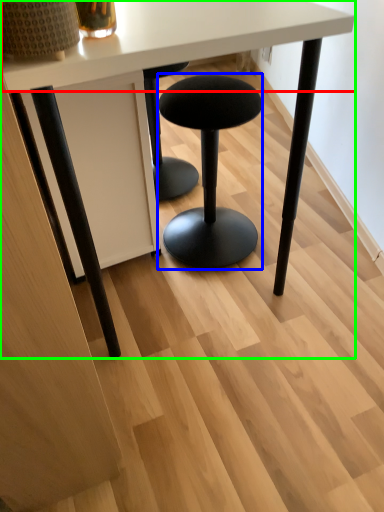
Question: Which object is the closest to the round table (highlighted by a red box)? Choose among these: stool (highlighted by a blue box) or table (highlighted by a green box).

Choices:
 (A) stool
 (B) table

Answer: (B)